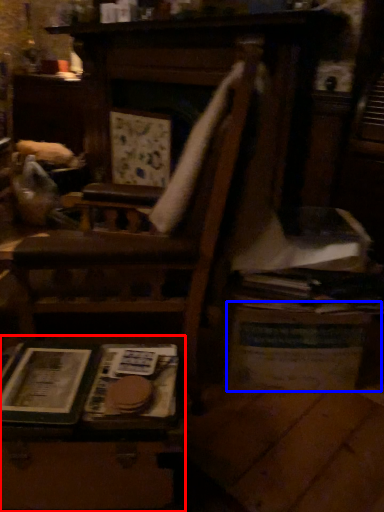
Question: Which object is further to the camera taking this photo, table (highlighted by a red box) or table (highlighted by a blue box)?

Choices:
 (A) table
 (B) table

Answer: (B)